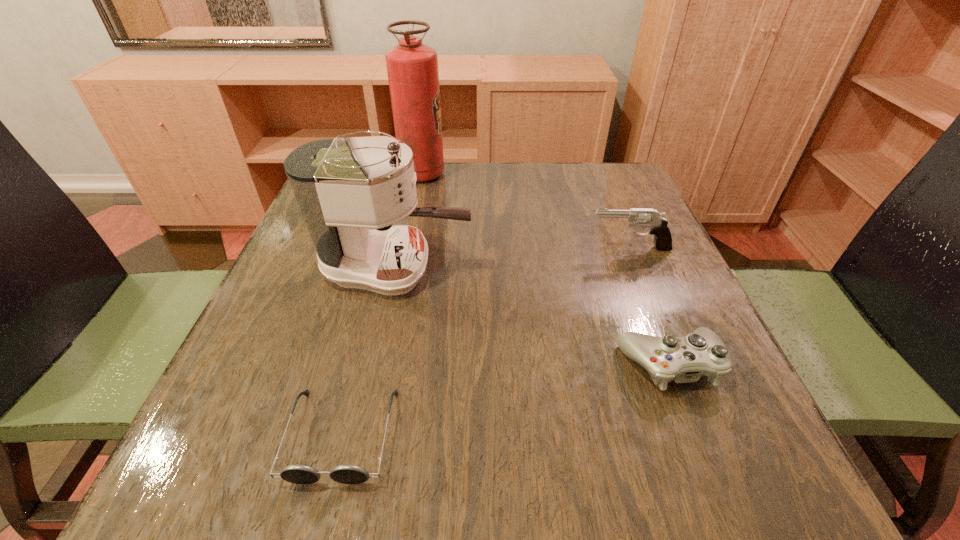
Where is `empty location between the gun and the control`? The image size is (960, 540). empty location between the gun and the control is located at coordinates (650, 306).

The height and width of the screenshot is (540, 960). Find the location of `free space between the third shortest object and the shortest object`. free space between the third shortest object and the shortest object is located at coordinates (486, 341).

The width and height of the screenshot is (960, 540). I want to click on free space between the sunglasses and the control, so click(506, 400).

You are a GUI agent. You are given a task and a screenshot of the screen. Output one action in this format:
    pyautogui.click(x=<x>, y=<y>)
    Task: Click on the vacant space that is in between the fire extinguisher and the gun
    
    Given the screenshot: What is the action you would take?
    pyautogui.click(x=526, y=211)

The image size is (960, 540). I want to click on unoccupied position between the third shortest object and the coffee maker, so click(x=513, y=258).

At what (x,y) coordinates should I click in order to perform the action: click on object that is the third closest one to the farthest object. Please return your answer as a coordinate pair (x, y). The width and height of the screenshot is (960, 540). Looking at the image, I should click on (684, 359).

Where is `object that is the fourth closest to the sunglasses`? Image resolution: width=960 pixels, height=540 pixels. object that is the fourth closest to the sunglasses is located at coordinates (412, 67).

I want to click on vacant space that satisfies the following two spatial constraints: 1. on the label side of the fire extinguisher; 2. on the back side of the control, so click(x=386, y=364).

Image resolution: width=960 pixels, height=540 pixels. I want to click on vacant space that satisfies the following two spatial constraints: 1. on the front-facing side of the fourth shortest object; 2. on the front-facing side of the sunglasses, so click(x=359, y=435).

Find the location of `vacant region that satisfies the following two spatial constraints: 1. on the front-facing side of the second tallest object; 2. on the left side of the control`. vacant region that satisfies the following two spatial constraints: 1. on the front-facing side of the second tallest object; 2. on the left side of the control is located at coordinates (374, 364).